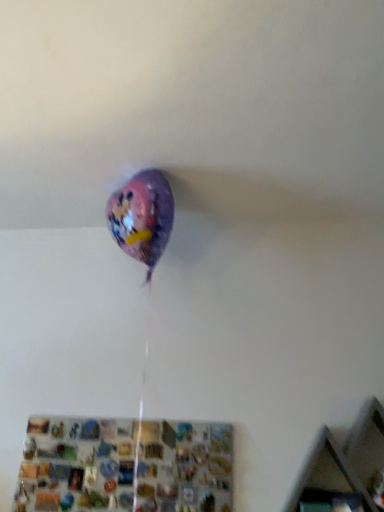
Question: In terms of width, does metallic mosaic shelf at lower center, which is the 1th shelf in left-to-right order, look wider or thinner when compared to wooden at upper right, which is counted as the 2th shelf, starting from the left?

Choices:
 (A) wide
 (B) thin

Answer: (B)

Question: Is metallic mosaic shelf at lower center, which appears as the 2th shelf when viewed from the right, situated inside wooden at upper right, arranged as the 1th shelf when viewed from the right, or outside?

Choices:
 (A) inside
 (B) outside

Answer: (B)

Question: In the image, is metallic mosaic shelf at lower center, which appears as the 2th shelf when viewed from the right, on the left side or the right side of wooden at upper right, arranged as the 1th shelf when viewed from the right?

Choices:
 (A) right
 (B) left

Answer: (B)

Question: From a real-world perspective, is wooden at upper right, which is counted as the 2th shelf, starting from the left, positioned above or below metallic mosaic shelf at lower center, which is the 1th shelf in left-to-right order?

Choices:
 (A) above
 (B) below

Answer: (A)

Question: Is wooden at upper right, which is counted as the 2th shelf, starting from the left, inside or outside of metallic mosaic shelf at lower center, which appears as the 2th shelf when viewed from the right?

Choices:
 (A) inside
 (B) outside

Answer: (B)

Question: From the image's perspective, is wooden at upper right, arranged as the 1th shelf when viewed from the right, above or below metallic mosaic shelf at lower center, which is the 1th shelf in left-to-right order?

Choices:
 (A) below
 (B) above

Answer: (B)

Question: Looking at their shapes, would you say wooden at upper right, arranged as the 1th shelf when viewed from the right, is wider or thinner than metallic mosaic shelf at lower center, which appears as the 2th shelf when viewed from the right?

Choices:
 (A) wide
 (B) thin

Answer: (A)